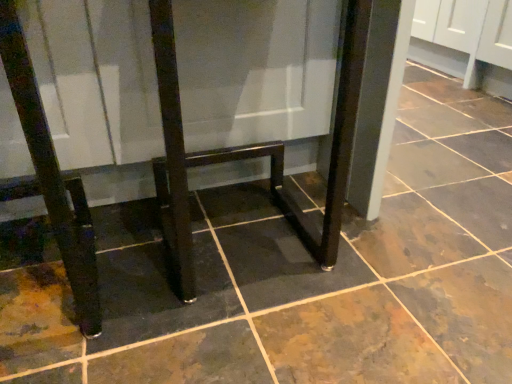
Question: Is glossy dark wood table at center, the 2th furniture from the left, wider or thinner than glossy dark wood table at center, which is counted as the 1th furniture, starting from the left?

Choices:
 (A) thin
 (B) wide

Answer: (A)

Question: Is point (335, 231) closer or farther from the camera than point (369, 3)?

Choices:
 (A) farther
 (B) closer

Answer: (A)

Question: Considering the positions of glossy dark wood table at center, the 2th furniture from the left, and glossy dark wood table at center, the 2th furniture when ordered from right to left, in the image, is glossy dark wood table at center, the 2th furniture from the left, taller or shorter than glossy dark wood table at center, the 2th furniture when ordered from right to left,?

Choices:
 (A) tall
 (B) short

Answer: (B)

Question: Does point (167, 246) appear closer or farther from the camera than point (187, 158)?

Choices:
 (A) closer
 (B) farther

Answer: (A)

Question: Considering the positions of glossy dark wood table at center, which is counted as the 1th furniture, starting from the left, and glossy dark wood table at center, the 2th furniture from the left, in the image, is glossy dark wood table at center, which is counted as the 1th furniture, starting from the left, bigger or smaller than glossy dark wood table at center, the 2th furniture from the left,?

Choices:
 (A) small
 (B) big

Answer: (B)

Question: In the image, is glossy dark wood table at center, the 2th furniture when ordered from right to left, on the left side or the right side of glossy dark wood table at center, which appears as the first furniture when viewed from the right?

Choices:
 (A) right
 (B) left

Answer: (B)

Question: From the image's perspective, is glossy dark wood table at center, which is counted as the 1th furniture, starting from the left, located above or below glossy dark wood table at center, which appears as the first furniture when viewed from the right?

Choices:
 (A) below
 (B) above

Answer: (B)